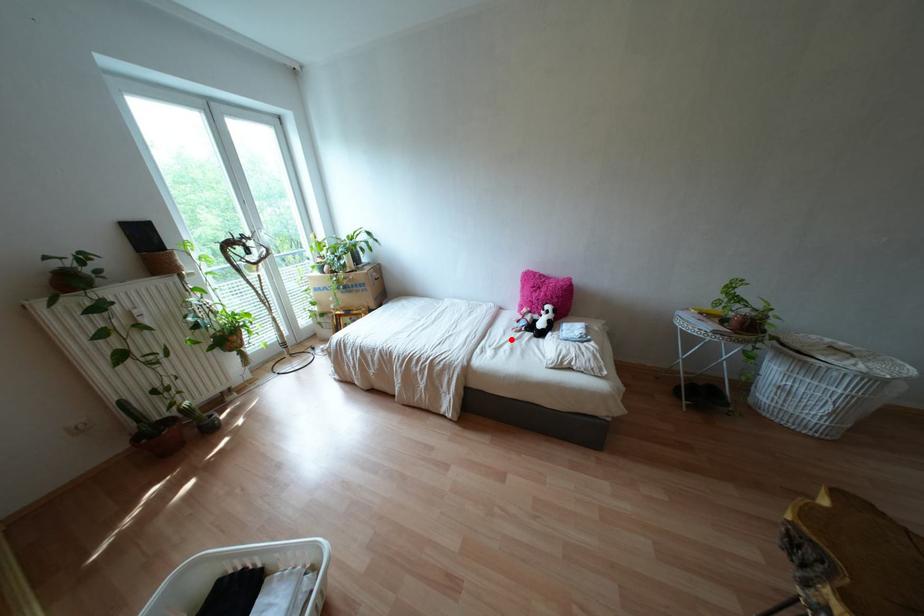
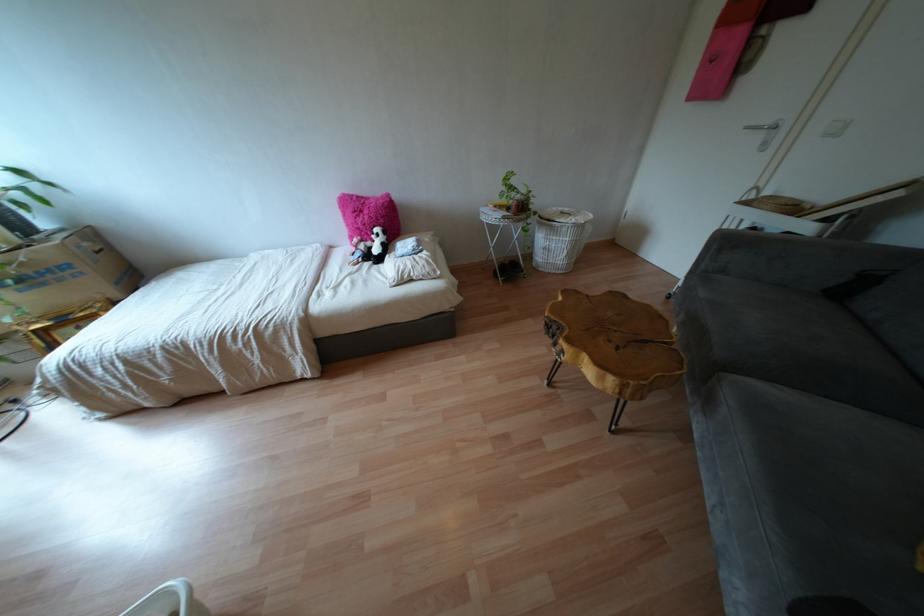
Locate, in the second image, the point that corresponds to the highlighted location in the first image.

(349, 274)